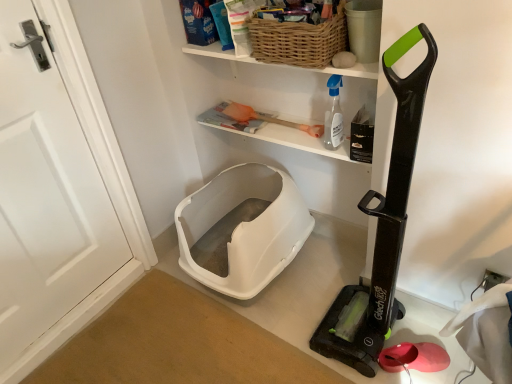
Question: Is black plastic vacuum cleaner at right in front of or behind woven brown basket at upper center in the image?

Choices:
 (A) front
 (B) behind

Answer: (A)

Question: Is black plastic vacuum cleaner at right inside or outside of woven brown basket at upper center?

Choices:
 (A) inside
 (B) outside

Answer: (B)

Question: Which is farther from the woven wood shelf at upper center?

Choices:
 (A) white matte door at left
 (B) white plastic litter box at lower center
 (C) black plastic vacuum cleaner at right
 (D) woven brown basket at upper center
 (E) transparent plastic spray bottle at upper center

Answer: (A)

Question: Which is farther from the woven wood shelf at upper center?

Choices:
 (A) transparent plastic spray bottle at upper center
 (B) white plastic litter box at lower center
 (C) woven brown basket at upper center
 (D) white matte door at left
 (E) black plastic vacuum cleaner at right

Answer: (D)